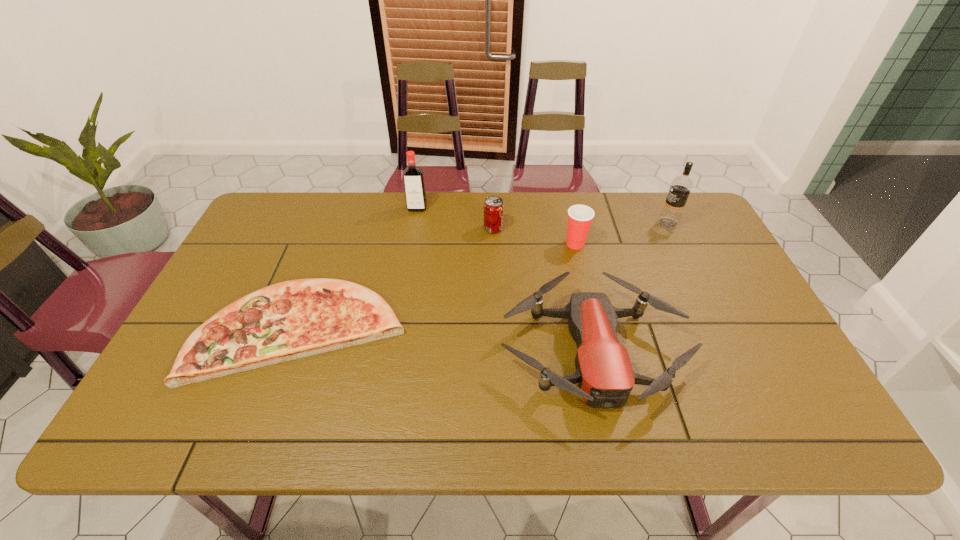
This screenshot has width=960, height=540. In order to click on free location located on the label of the rightmost object in this screenshot , I will do `click(588, 223)`.

Image resolution: width=960 pixels, height=540 pixels. Identify the location of free space located 0.290m on the front and back of the farthest object. (406, 274).

The height and width of the screenshot is (540, 960). What are the coordinates of `free space located 0.220m on the right of the fourth farthest object` in the screenshot? It's located at (660, 244).

You are a GUI agent. You are given a task and a screenshot of the screen. Output one action in this format:
    pyautogui.click(x=<x>, y=<y>)
    Task: Click on the vacant space located on the front of the pop soda
    Image resolution: width=960 pixels, height=540 pixels.
    Given the screenshot: What is the action you would take?
    pyautogui.click(x=495, y=301)

Image resolution: width=960 pixels, height=540 pixels. What are the coordinates of `free region located on the back of the shortest object` in the screenshot? It's located at (324, 270).

At what (x,y) coordinates should I click in order to perform the action: click on Dixie cup located in the far edge section of the desktop. Please return your answer as a coordinate pair (x, y). Looking at the image, I should click on (580, 217).

Where is `pop soda at the far edge`? The image size is (960, 540). pop soda at the far edge is located at coordinates (493, 215).

The height and width of the screenshot is (540, 960). I want to click on object present at the near edge, so click(x=604, y=373).

The width and height of the screenshot is (960, 540). In order to click on object located in the left edge section of the desktop in this screenshot , I will do `click(298, 318)`.

Where is `object that is at the right edge`? This screenshot has width=960, height=540. object that is at the right edge is located at coordinates (681, 186).